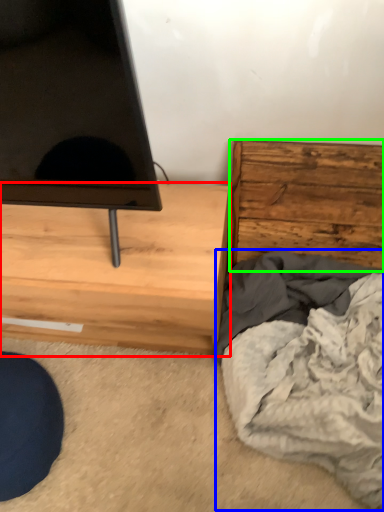
Question: Which is farther away from chest of drawers (highlighted by a red box)? blanket (highlighted by a blue box) or chest of drawers (highlighted by a green box)?

Choices:
 (A) blanket
 (B) chest of drawers

Answer: (B)